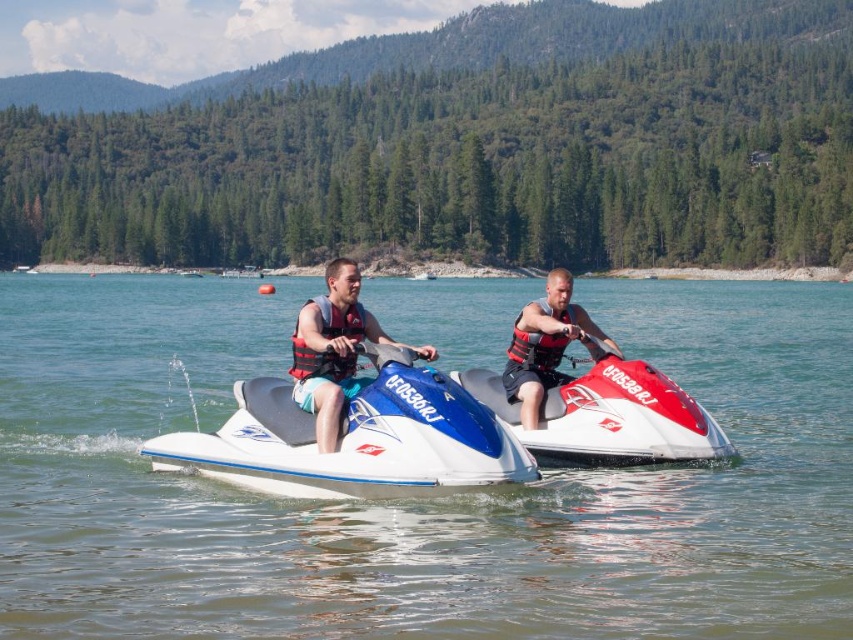
Question: Does clear blue water at center have a smaller size compared to matte red life vest at center?

Choices:
 (A) yes
 (B) no

Answer: (B)

Question: Among these points, which one is farthest from the camera?

Choices:
 (A) (535, 339)
 (B) (555, 346)
 (C) (370, 324)

Answer: (B)

Question: Estimate the real-world distances between objects in this image. Which object is closer to the red matte jet ski at center?

Choices:
 (A) red and white jet ski at center
 (B) clear blue water at center

Answer: (A)

Question: Is red and white jet ski at center below red mesh life jacket at center?

Choices:
 (A) yes
 (B) no

Answer: (B)

Question: Which object is positioned farthest from the clear blue water at center?

Choices:
 (A) red matte jet ski at center
 (B) matte red life vest at center
 (C) red mesh life jacket at center

Answer: (A)

Question: Is red and white jet ski at center smaller than red nylon life jacket at center?

Choices:
 (A) yes
 (B) no

Answer: (B)